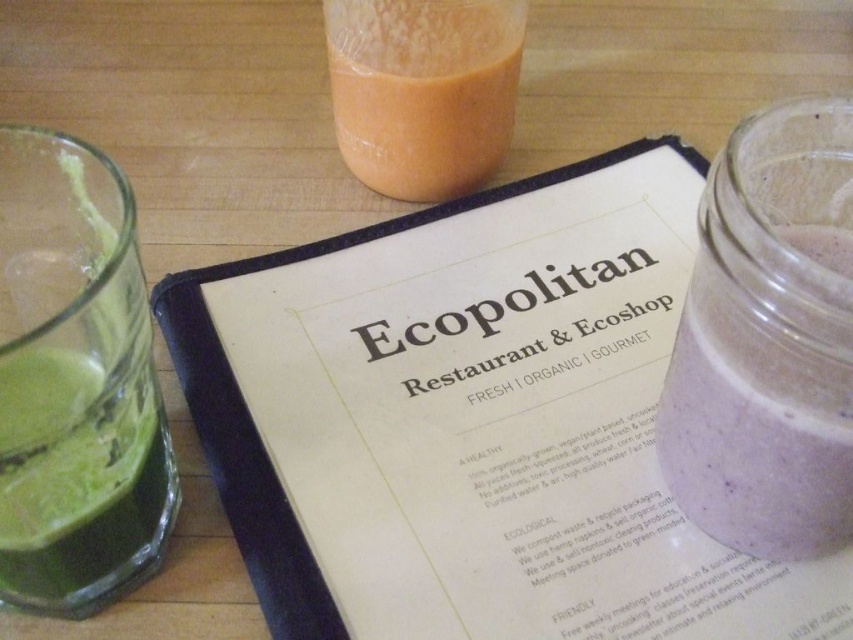
Question: Can you confirm if white paper menu at center is thinner than orange translucent glass at upper center?

Choices:
 (A) yes
 (B) no

Answer: (B)

Question: Does purple smoothie at right appear on the right side of orange translucent glass at upper center?

Choices:
 (A) no
 (B) yes

Answer: (B)

Question: Among these objects, which one is nearest to the camera?

Choices:
 (A) white paper menu at center
 (B) green smoothie at lower left
 (C) orange translucent glass at upper center
 (D) purple smoothie at right

Answer: (B)

Question: Which point appears closest to the camera in this image?

Choices:
 (A) (350, 52)
 (B) (96, 157)
 (C) (19, 545)
 (D) (782, 364)

Answer: (D)

Question: Is white paper menu at center bigger than green glass at left?

Choices:
 (A) no
 (B) yes

Answer: (B)

Question: Which object appears closest to the camera in this image?

Choices:
 (A) green glass at left
 (B) purple smoothie at right
 (C) green smoothie at lower left
 (D) white paper menu at center

Answer: (A)